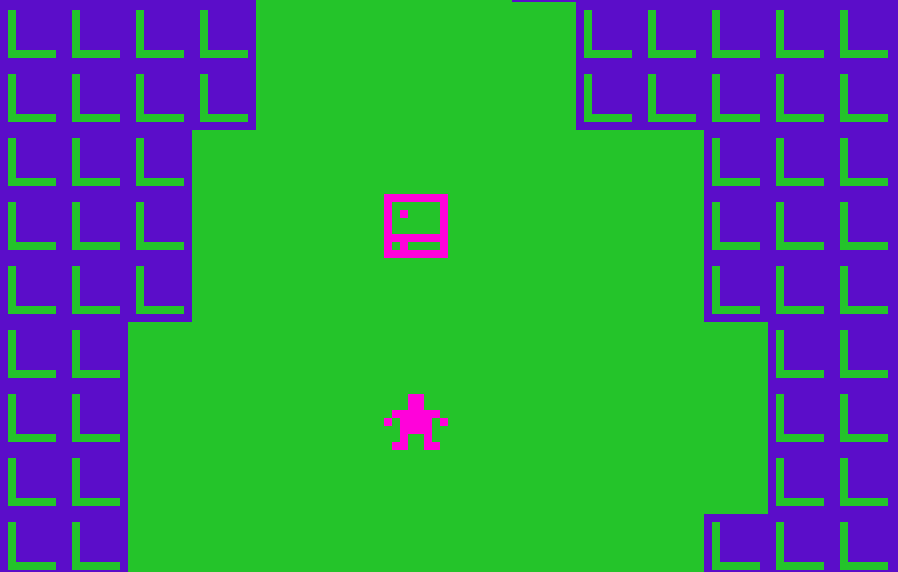
Image resolution: width=898 pixels, height=572 pixels. I want to click on floor, so click(526, 353).